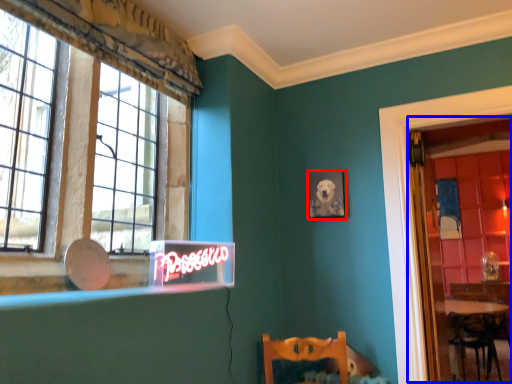
Question: Which object appears farthest to the camera in this image, picture frame (highlighted by a red box) or glass door (highlighted by a blue box)?

Choices:
 (A) picture frame
 (B) glass door

Answer: (A)